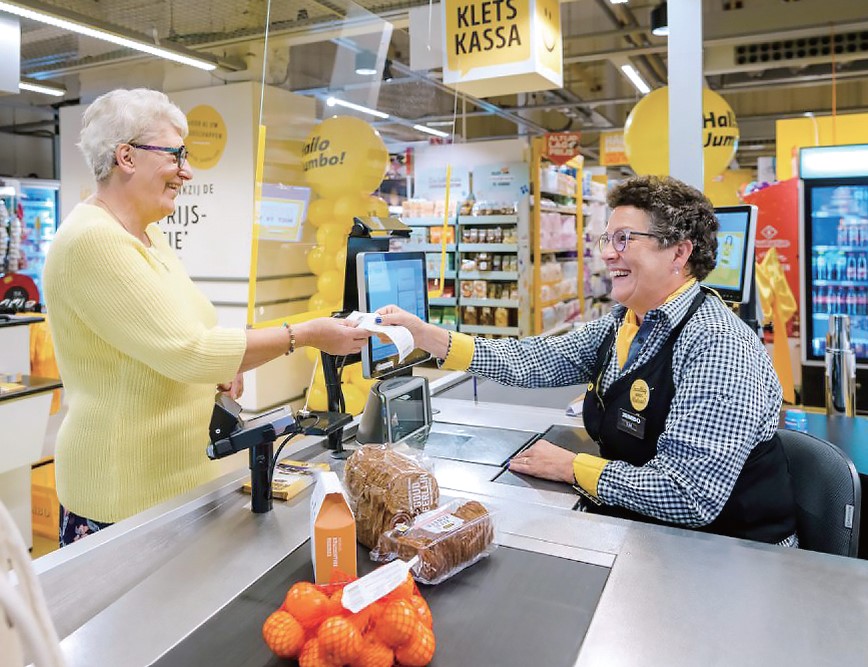
The width and height of the screenshot is (868, 667). I want to click on lights, so click(159, 53), click(356, 107), click(42, 89), click(632, 85).